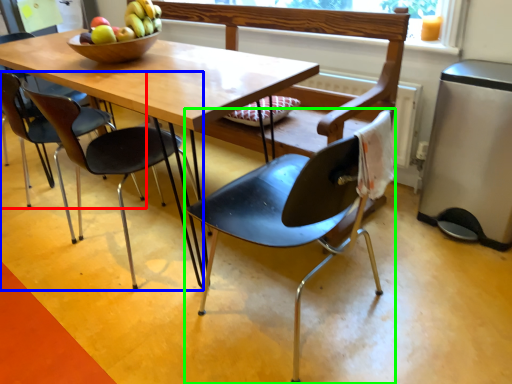
Question: Estimate the real-world distances between objects in this image. Which object is farther from chair (highlighted by a red box), chair (highlighted by a blue box) or chair (highlighted by a green box)?

Choices:
 (A) chair
 (B) chair

Answer: (B)